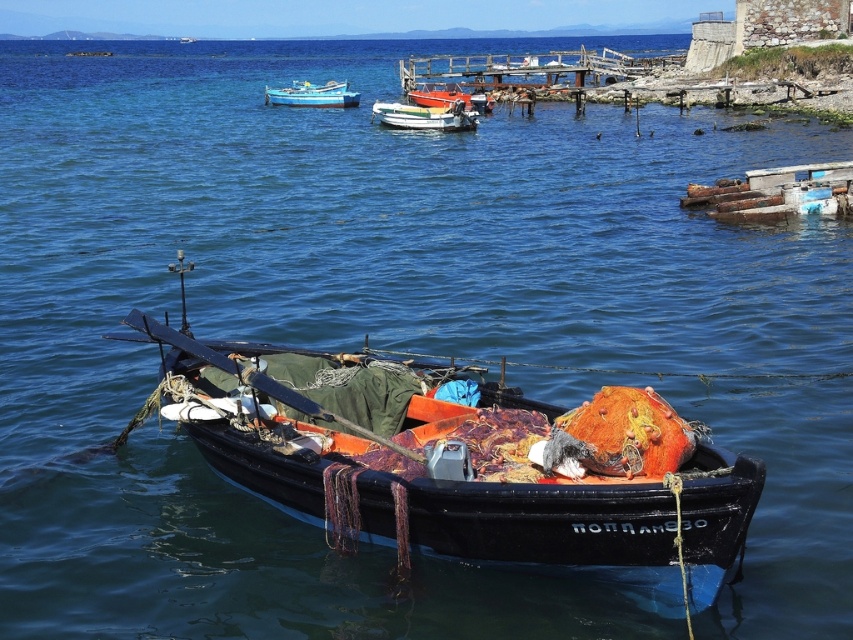
Is black wooden boat at center thinner than blue painted wooden boat at upper center?

Yes, black wooden boat at center is thinner than blue painted wooden boat at upper center.

Who is positioned more to the left, black wooden boat at center or blue painted wooden boat at upper center?

blue painted wooden boat at upper center is more to the left.

Which is behind, point (747, 486) or point (329, 81)?

Point (329, 81)

Image resolution: width=853 pixels, height=640 pixels. I want to click on black wooden boat at center, so click(x=479, y=474).

Is white glossy boat at center above orange fabric boat at center?

No, white glossy boat at center is not above orange fabric boat at center.

Is white glossy boat at center wider than orange fabric boat at center?

Yes, white glossy boat at center is wider than orange fabric boat at center.

What do you see at coordinates (425, 116) in the screenshot? The image size is (853, 640). I see `white glossy boat at center` at bounding box center [425, 116].

Where is `white glossy boat at center`? white glossy boat at center is located at coordinates (425, 116).

Looking at this image, is white glossy boat at center bigger than blue painted wooden boat at upper center?

No, white glossy boat at center is not bigger than blue painted wooden boat at upper center.

Is point (451, 115) behind point (323, 88)?

No, it is in front of (323, 88).

Identify the location of white glossy boat at center. (425, 116).